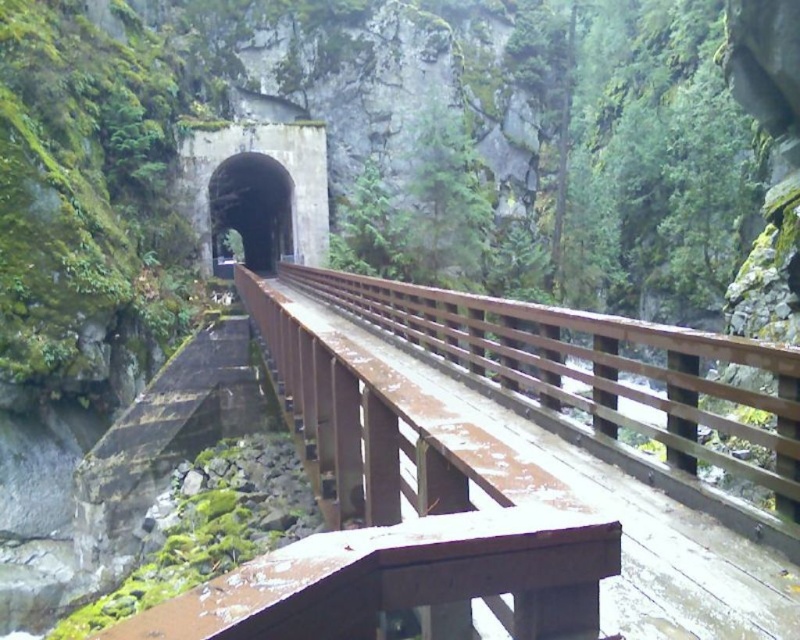
You are a hiker planning to cross the canyon. You see the rusty wood bridge at center and the black concrete tunnel at center. Which structure is closer to you as you stand on the canyon edge?

The rusty wood bridge at center is closer to you because it is in front of the black concrete tunnel at center.

You are a hiker standing on the rusty wood bridge at center and want to enter the concrete tunnel at center. Which direction should you walk to reach the tunnel?

The rusty wood bridge at center is to the right of the concrete tunnel at center, so you should walk to the left to reach the tunnel.